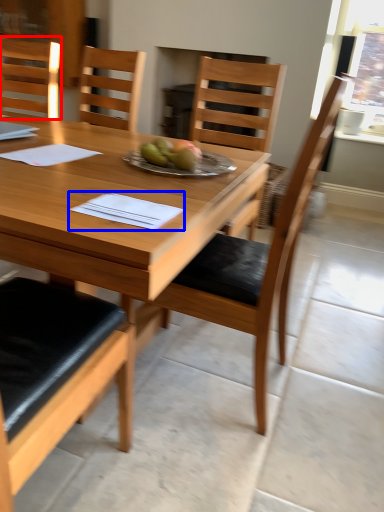
Question: Which of the following is the farthest to the observer, chair (highlighted by a red box) or notebook (highlighted by a blue box)?

Choices:
 (A) chair
 (B) notebook

Answer: (A)